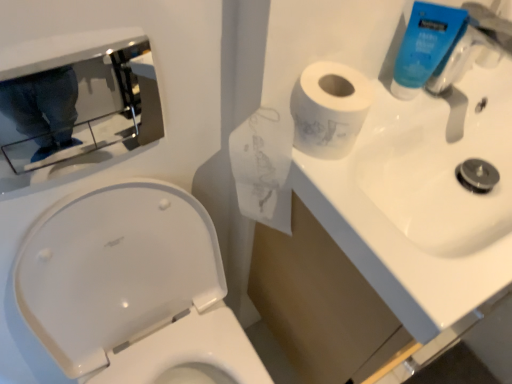
Find the location of a particular element. Image resolution: width=512 pixels, height=384 pixels. vacant space positioned to the left of blue plastic faucet at upper right is located at coordinates (390, 127).